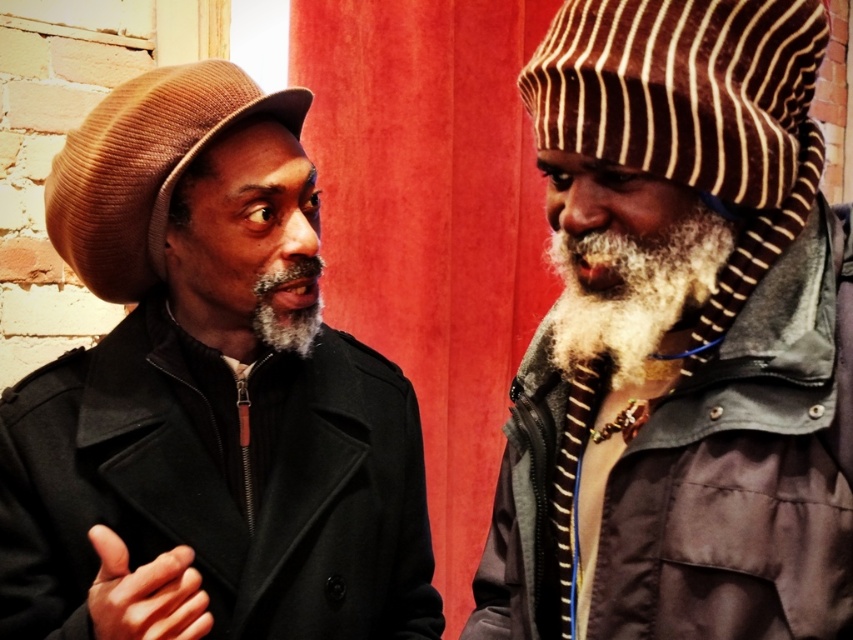
Question: Which of the following is the closest to the observer?

Choices:
 (A) striped knit hat at right
 (B) gray matte beard at left
 (C) matte brown hat at left

Answer: (A)

Question: Which point is farther to the camera?

Choices:
 (A) striped knit hat at right
 (B) matte brown hat at left
 (C) gray matte beard at left

Answer: (C)

Question: Which point appears closest to the camera in this image?

Choices:
 (A) (212, 202)
 (B) (544, 595)
 (C) (572, 330)
 (D) (293, 264)

Answer: (C)

Question: Does brown corduroy hat at left come behind white fuzzy beard at center?

Choices:
 (A) yes
 (B) no

Answer: (A)

Question: Is striped knit hat at right in front of gray matte beard at left?

Choices:
 (A) no
 (B) yes

Answer: (B)

Question: Can you confirm if white fuzzy beard at center is positioned to the right of gray matte beard at left?

Choices:
 (A) yes
 (B) no

Answer: (A)